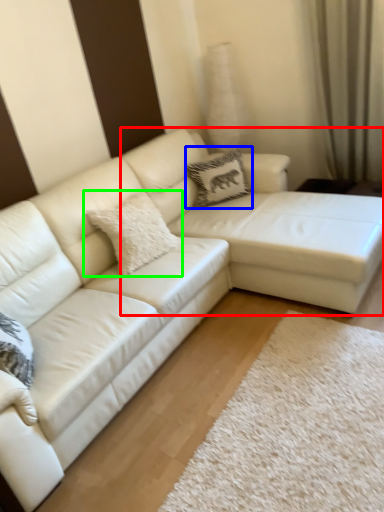
Question: Which object is the farthest from couch (highlighted by a red box)? Choose among these: pillow (highlighted by a blue box) or pillow (highlighted by a green box).

Choices:
 (A) pillow
 (B) pillow

Answer: (B)